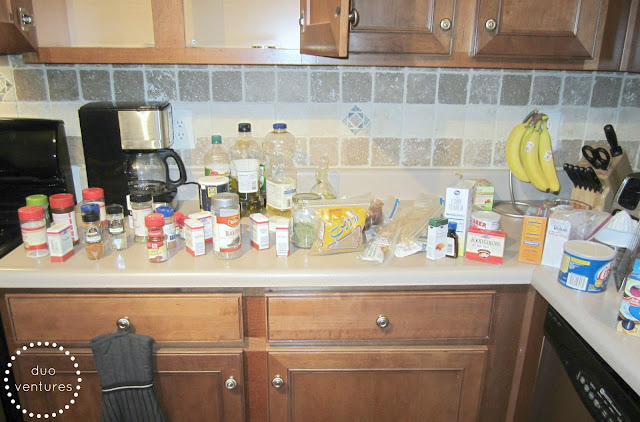
Locate an element on the screen. coffee pot is located at coordinates (148, 144).